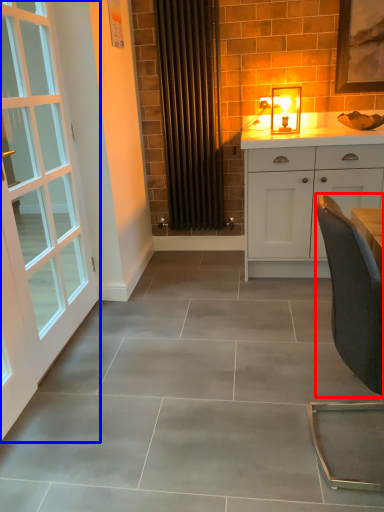
Question: Among these objects, which one is nearest to the camera, chair (highlighted by a red box) or door (highlighted by a blue box)?

Choices:
 (A) chair
 (B) door

Answer: (A)